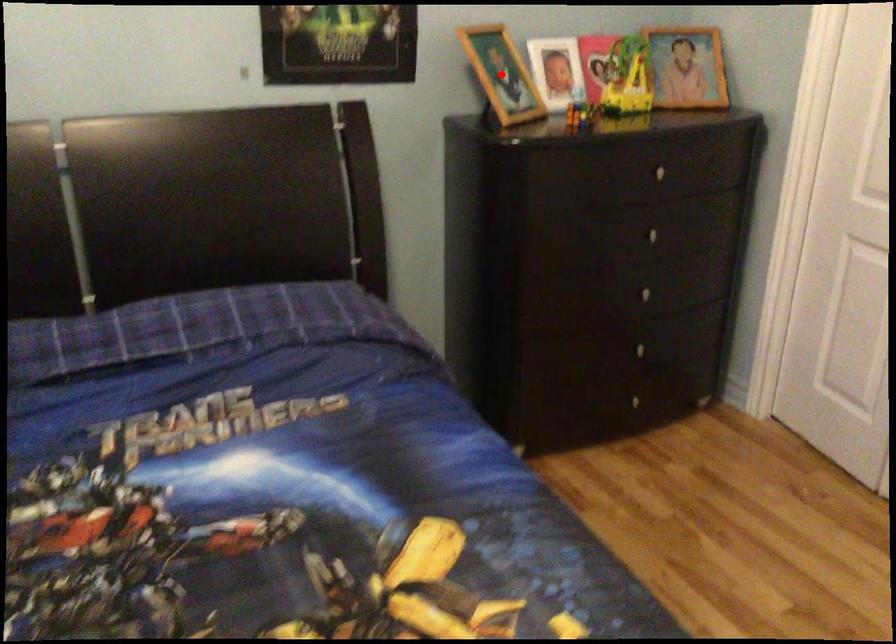
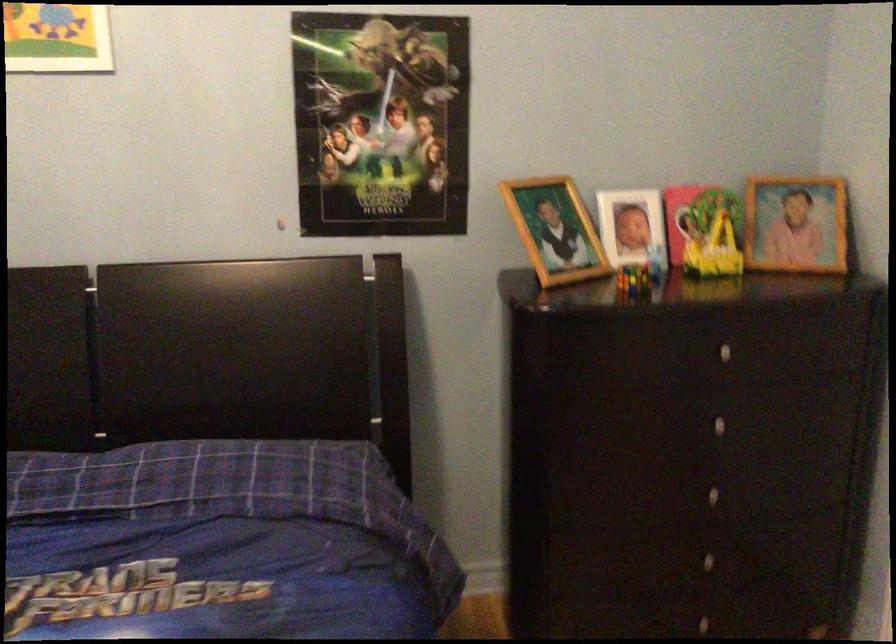
The point at the highlighted location is marked in the first image. Where is the corresponding point in the second image?

(555, 230)